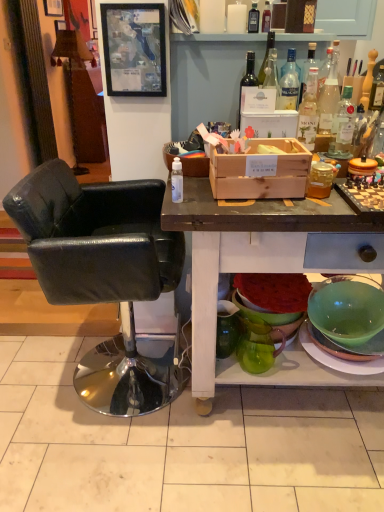
Where is `free space that is to the left of black leather chair at left`? The height and width of the screenshot is (512, 384). free space that is to the left of black leather chair at left is located at coordinates (31, 368).